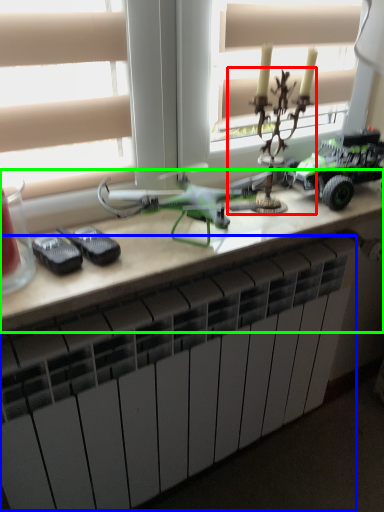
Question: Which object is positioned farthest from toy (highlighted by a red box)? Select from radiator (highlighted by a blue box) and table (highlighted by a green box).

Choices:
 (A) radiator
 (B) table

Answer: (A)